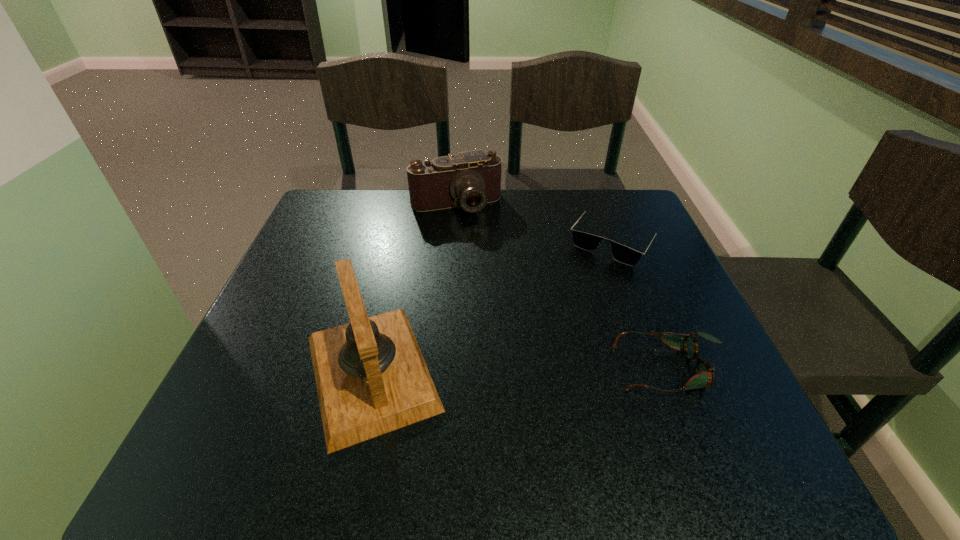
This screenshot has height=540, width=960. In order to click on the closest object to the camera in this screenshot , I will do `click(588, 242)`.

This screenshot has width=960, height=540. What are the coordinates of `object that is the second closest to the camera` in the screenshot? It's located at (371, 378).

Find the location of `vacant space that satisfies the following two spatial constraints: 1. on the front side of the third shortest object; 2. on the front-facing side of the spectacles`. vacant space that satisfies the following two spatial constraints: 1. on the front side of the third shortest object; 2. on the front-facing side of the spectacles is located at coordinates (444, 368).

Identify the location of free spot that satisfies the following two spatial constraints: 1. on the back side of the sunglasses; 2. on the right side of the bell. pyautogui.click(x=401, y=240).

Locate an element on the screen. The height and width of the screenshot is (540, 960). free location that satisfies the following two spatial constraints: 1. on the front side of the spectacles; 2. on the front-facing side of the camera is located at coordinates tap(444, 368).